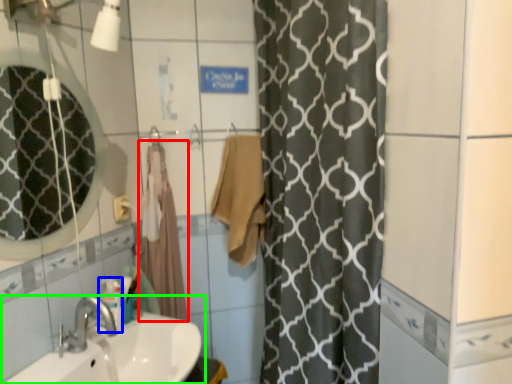
Question: Estimate the real-world distances between objects in this image. Which object is farther from bath towel (highlighted by a red box), toiletry (highlighted by a blue box) or sink (highlighted by a green box)?

Choices:
 (A) toiletry
 (B) sink

Answer: (B)